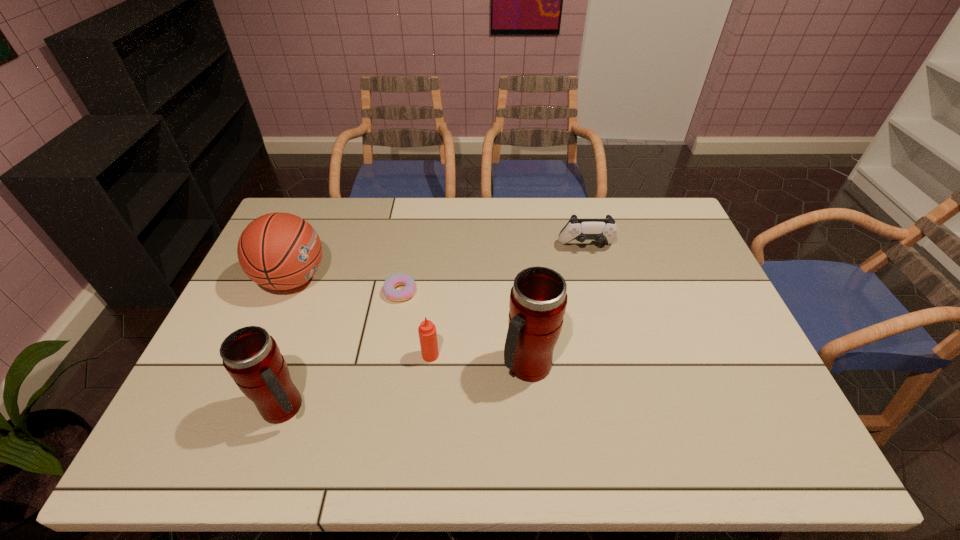
Locate which object ranks third in proximity to the basketball. Please provide its 2D coordinates. Your answer should be formatted as a tuple, i.e. [(x, y)], where the tuple contains the x and y coordinates of a point satisfying the conditions above.

[(427, 332)]

I want to click on object that can be found as the fifth closest to the tallest object, so point(280,251).

Image resolution: width=960 pixels, height=540 pixels. Find the location of `vacant space that satisfies the following two spatial constraints: 1. on the logo side of the fourth tallest object; 2. on the left side of the basketball`. vacant space that satisfies the following two spatial constraints: 1. on the logo side of the fourth tallest object; 2. on the left side of the basketball is located at coordinates (260, 355).

The image size is (960, 540). What are the coordinates of `free spot that satisfies the following two spatial constraints: 1. on the logo side of the doughnut; 2. on the right side of the basketball` in the screenshot? It's located at (287, 291).

You are a GUI agent. You are given a task and a screenshot of the screen. Output one action in this format:
    pyautogui.click(x=<x>, y=<y>)
    Task: Click on the vacant space that satisfies the following two spatial constraints: 1. on the logo side of the doughnut; 2. on the right side of the basketball
    Image resolution: width=960 pixels, height=540 pixels.
    Given the screenshot: What is the action you would take?
    pyautogui.click(x=287, y=291)

The image size is (960, 540). I want to click on free space that satisfies the following two spatial constraints: 1. on the front-facing side of the control; 2. on the logo side of the basketball, so click(594, 279).

You are a GUI agent. You are given a task and a screenshot of the screen. Output one action in this format:
    pyautogui.click(x=<x>, y=<y>)
    Task: Click on the vacant space that satisfies the following two spatial constraints: 1. on the back side of the Tabasco sauce; 2. on the logo side of the basketball
    The width and height of the screenshot is (960, 540).
    Given the screenshot: What is the action you would take?
    pyautogui.click(x=438, y=279)